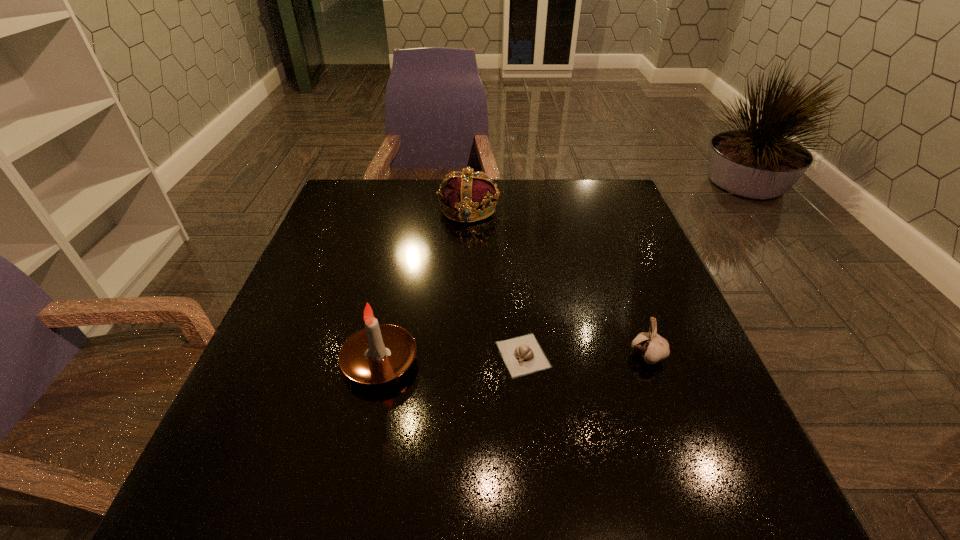
This screenshot has height=540, width=960. Find the location of `candle`. candle is located at coordinates (378, 353).

Where is `the farthest object`? This screenshot has height=540, width=960. the farthest object is located at coordinates (468, 195).

At what (x,y) coordinates should I click in order to perform the action: click on crown. Please return your answer as a coordinate pair (x, y). Looking at the image, I should click on (468, 195).

Locate an element on the screen. The image size is (960, 540). the second shortest object is located at coordinates (653, 348).

The width and height of the screenshot is (960, 540). I want to click on the taller garlic, so click(653, 348).

In order to click on the shortest object in this screenshot , I will do `click(522, 355)`.

Where is `the left garlic`? the left garlic is located at coordinates (522, 355).

The height and width of the screenshot is (540, 960). I want to click on vacant space located on the right of the tallest object, so click(x=591, y=361).

I want to click on free region located 0.050m on the front of the second tallest object, so click(468, 237).

Locate an element on the screen. Image resolution: width=960 pixels, height=540 pixels. vacant space located 0.340m on the back of the right garlic is located at coordinates (607, 242).